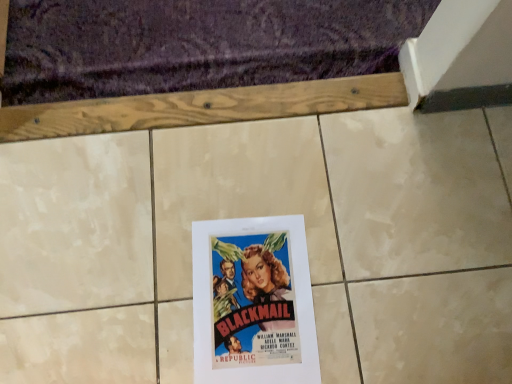
Find the location of a particular element. free space below matte paper poster at center (from a real-world perspective) is located at coordinates (253, 301).